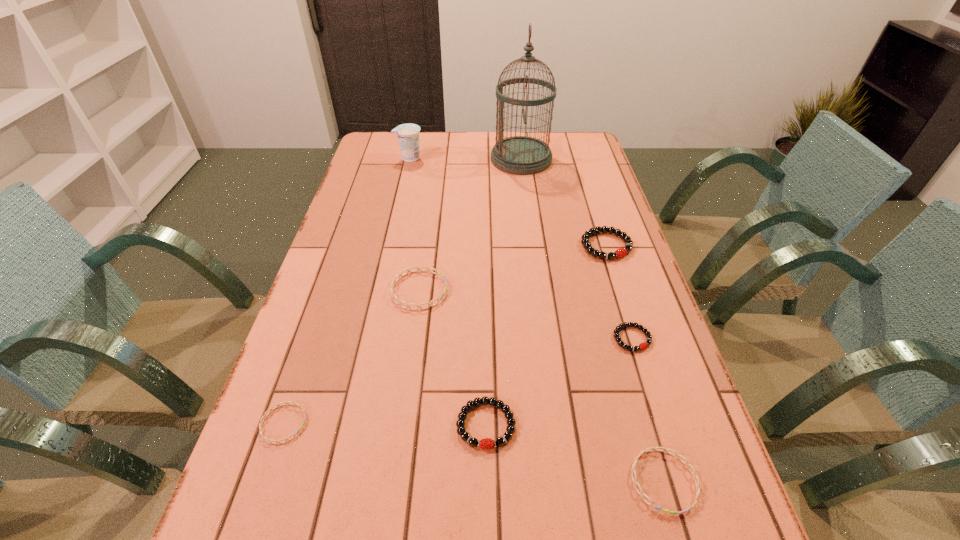
The image size is (960, 540). Identify the location of empty space between the third farthest object and the third farthest bracelet. (619, 292).

Find the location of `free area in between the rightmost blue bracelet and the shortest bracelet`. free area in between the rightmost blue bracelet and the shortest bracelet is located at coordinates (474, 452).

You are a GUI agent. You are given a task and a screenshot of the screen. Output one action in this format:
    pyautogui.click(x=<x>, y=<y>)
    Task: Click on the free space that is in between the farthest black bracelet and the second nearest black bracelet
    
    Given the screenshot: What is the action you would take?
    (619, 292)

Locate an element on the screen. the seventh closest object to the blue yogurt is located at coordinates (666, 450).

You are a GUI agent. You are given a task and a screenshot of the screen. Output one action in this format:
    pyautogui.click(x=<x>, y=<y>)
    Task: Click on the object that is the fifth closest to the fourth farthest object
    Image resolution: width=960 pixels, height=540 pixels.
    Given the screenshot: What is the action you would take?
    (666, 450)

Point out which bracelet is positioned as the nearest to the birdcage. Please provide its 2D coordinates. Your answer should be formatted as a tuple, i.e. [(x, y)], where the tuple contains the x and y coordinates of a point satisfying the conditions above.

[(619, 253)]

Locate an element on the screen. The height and width of the screenshot is (540, 960). bracelet identified as the fourth closest to the fourth nearest object is located at coordinates (394, 281).

Point out which black bracelet is positioned as the second nearest to the farthest blue bracelet. Please provide its 2D coordinates. Your answer should be formatted as a tuple, i.e. [(x, y)], where the tuple contains the x and y coordinates of a point satisfying the conditions above.

[(619, 253)]

The image size is (960, 540). Find the location of `black bracelet that stands as the closest to the farthest black bracelet`. black bracelet that stands as the closest to the farthest black bracelet is located at coordinates (642, 346).

The height and width of the screenshot is (540, 960). Identify the location of the second closest blue bracelet relative to the leftmost bracelet. (666, 450).